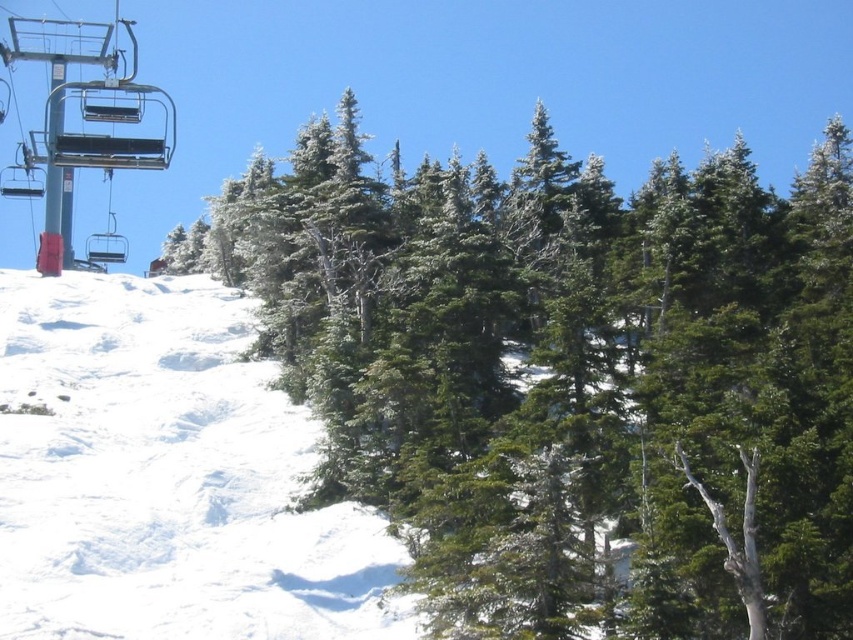
Question: Can you confirm if green matte tree at upper center is wider than white powdery snow at center?

Choices:
 (A) yes
 (B) no

Answer: (A)

Question: Is green matte tree at upper center wider than white powdery snow at center?

Choices:
 (A) yes
 (B) no

Answer: (A)

Question: Which point is closer to the camera?

Choices:
 (A) metallic blue ski lift at upper left
 (B) white powdery snow at center
 (C) green matte tree at upper center

Answer: (C)

Question: Based on their relative distances, which object is nearer to the green matte tree at upper center?

Choices:
 (A) metallic blue ski lift at upper left
 (B) white powdery snow at center

Answer: (B)

Question: Is green matte tree at upper center positioned at the back of metallic blue ski lift at upper left?

Choices:
 (A) yes
 (B) no

Answer: (B)

Question: Estimate the real-world distances between objects in this image. Which object is farther from the metallic blue ski lift at upper left?

Choices:
 (A) white powdery snow at center
 (B) green matte tree at upper center

Answer: (B)